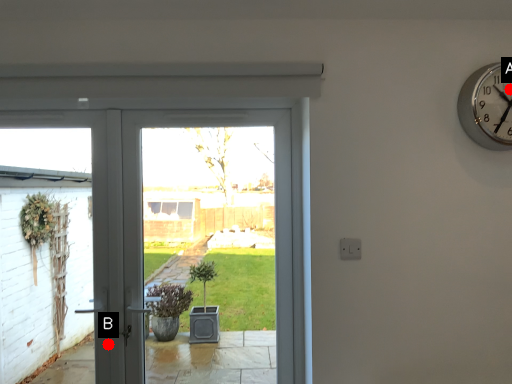
Question: Two points are circled on the image, labeled by A and B beside each circle. Which of the following is the closest to the observer?

Choices:
 (A) A is closer
 (B) B is closer

Answer: (A)